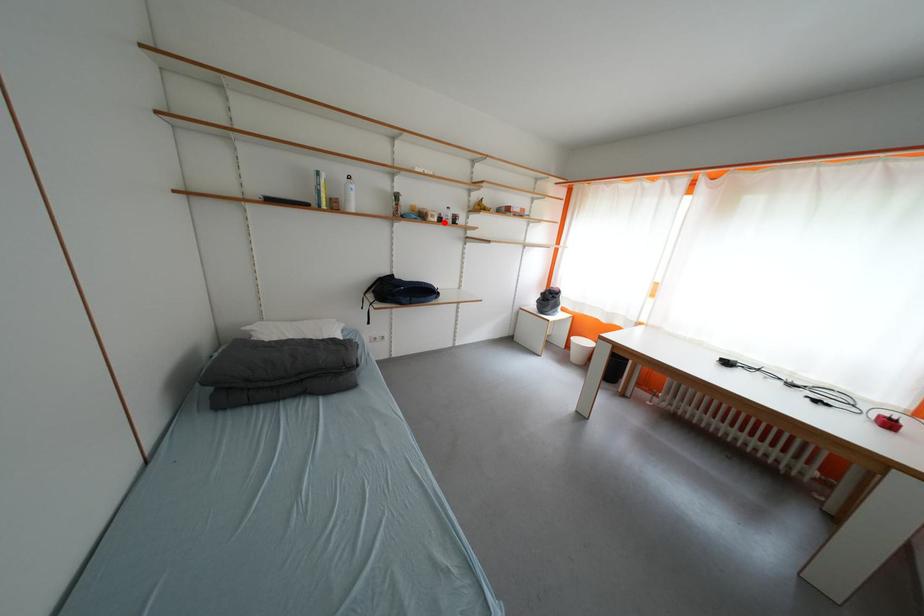
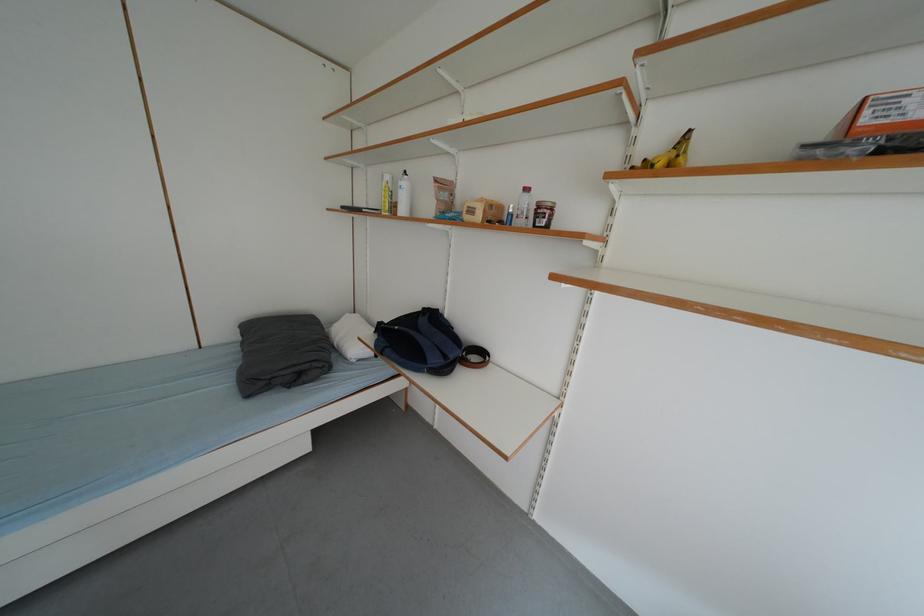
Where in the second image is the point corresponding to the highlighted location from the first image?

(487, 220)